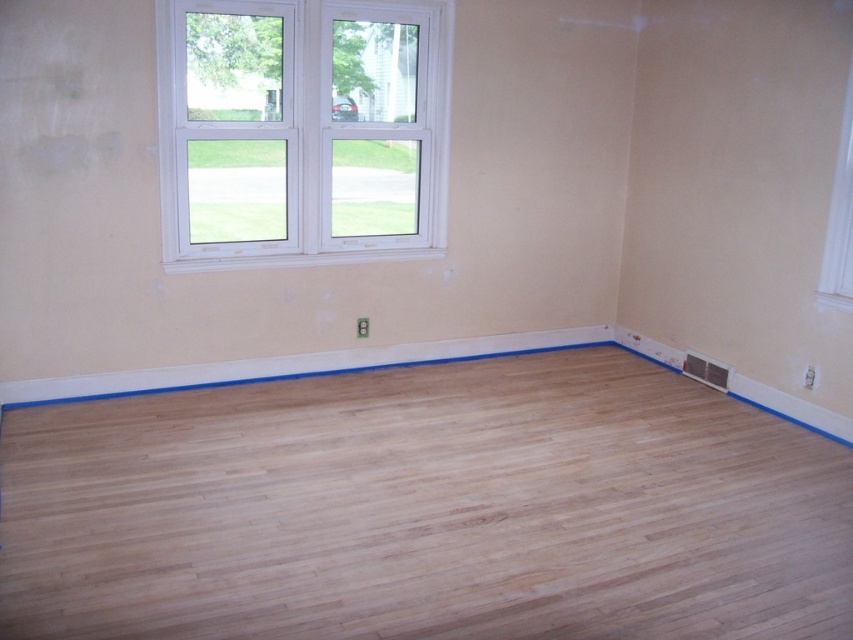
Does point (639, 413) lie in front of point (222, 84)?

That is False.

Is natural wood floor at center further to the viewer compared to white plastic window at upper left?

No, it is not.

Between point (654, 589) and point (332, 52), which one is positioned behind?

Positioned behind is point (332, 52).

Identify the location of natural wood floor at center. The height and width of the screenshot is (640, 853). [x=426, y=509].